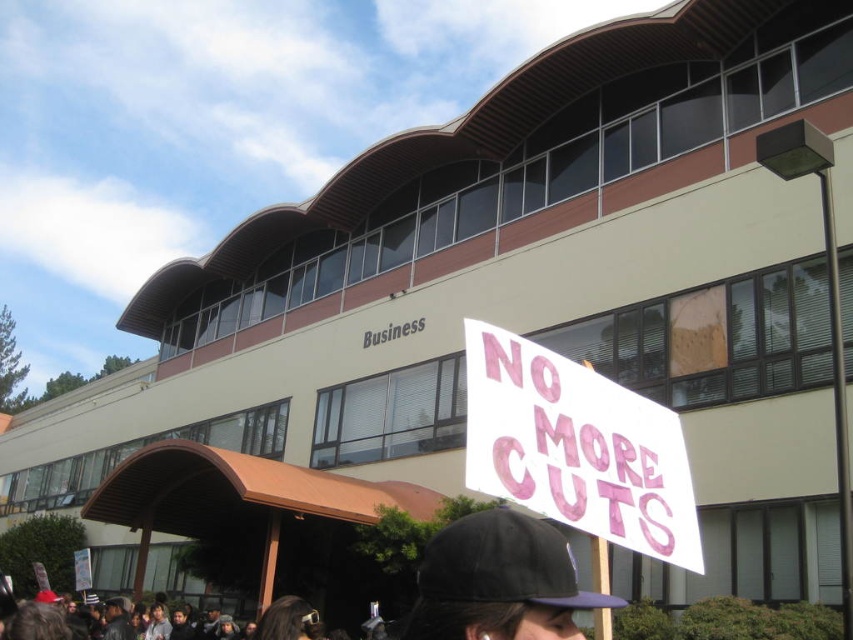
Does white paper sign at center appear on the left side of black fabric baseball cap at center?

Incorrect, white paper sign at center is not on the left side of black fabric baseball cap at center.

Between point (677, 548) and point (457, 534), which one is positioned behind?

Positioned behind is point (677, 548).

Find the location of a particular element. Image resolution: width=853 pixels, height=640 pixels. white paper sign at center is located at coordinates (576, 448).